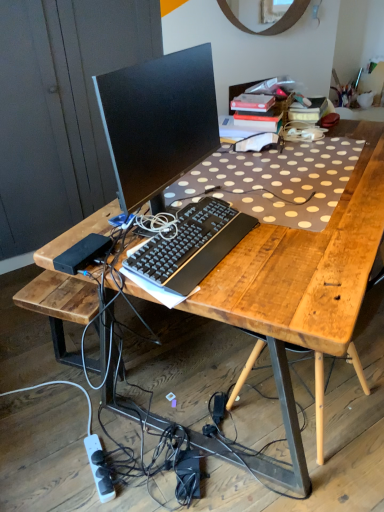
Locate an element on the screen. free location above wooden desk at center (from a real-world perspective) is located at coordinates (268, 184).